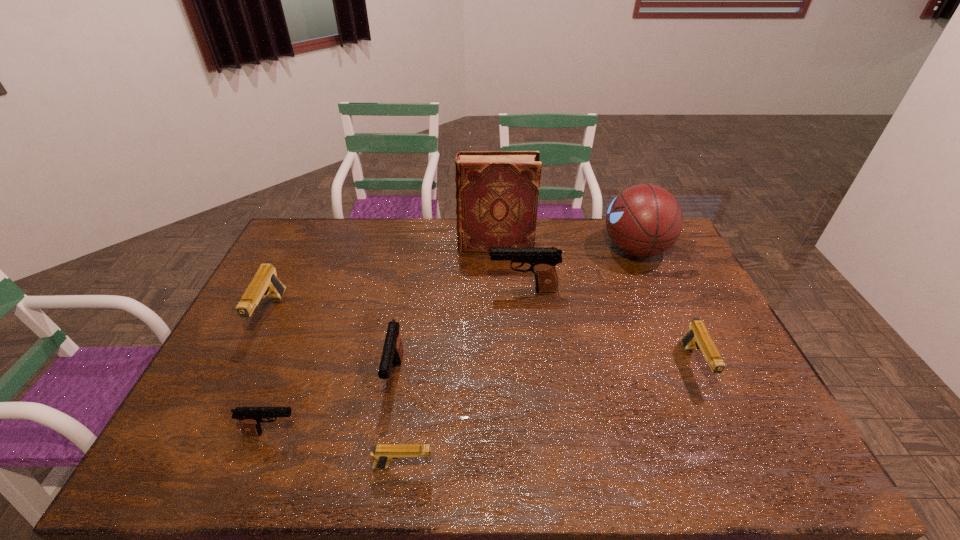
Where is `the smallest black pistol`? The width and height of the screenshot is (960, 540). the smallest black pistol is located at coordinates (250, 418).

Locate an element on the screen. The height and width of the screenshot is (540, 960). the second pistol from left to right is located at coordinates (250, 418).

Locate an element on the screen. This screenshot has width=960, height=540. the nearest object is located at coordinates (383, 453).

I want to click on the shortest object, so click(x=383, y=453).

Locate an element on the screen. This screenshot has width=960, height=540. blank space located on the spine side of the tallest object is located at coordinates (378, 245).

Locate an element on the screen. The width and height of the screenshot is (960, 540). free location located 0.190m on the spine side of the tallest object is located at coordinates (406, 245).

At what (x,y) coordinates should I click in order to perform the action: click on free space located on the spine side of the tallest object. Please return your answer as a coordinate pair (x, y). Looking at the image, I should click on (408, 245).

Find the location of a particular element. The image size is (960, 540). vacant space situated 0.390m on the left of the second tallest object is located at coordinates (493, 249).

At what (x,y) coordinates should I click in order to perform the action: click on vacant area located at the barrel of the rightmost black pistol. Please return your answer as a coordinate pair (x, y). The width and height of the screenshot is (960, 540). Looking at the image, I should click on (470, 290).

This screenshot has height=540, width=960. I want to click on vacant space located at the barrel of the rightmost black pistol, so click(x=434, y=290).